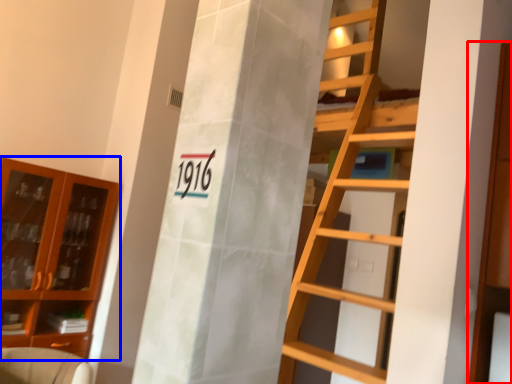
Question: Which object appears closest to the camera in this image, cabinetry (highlighted by a red box) or cabinetry (highlighted by a blue box)?

Choices:
 (A) cabinetry
 (B) cabinetry

Answer: (A)